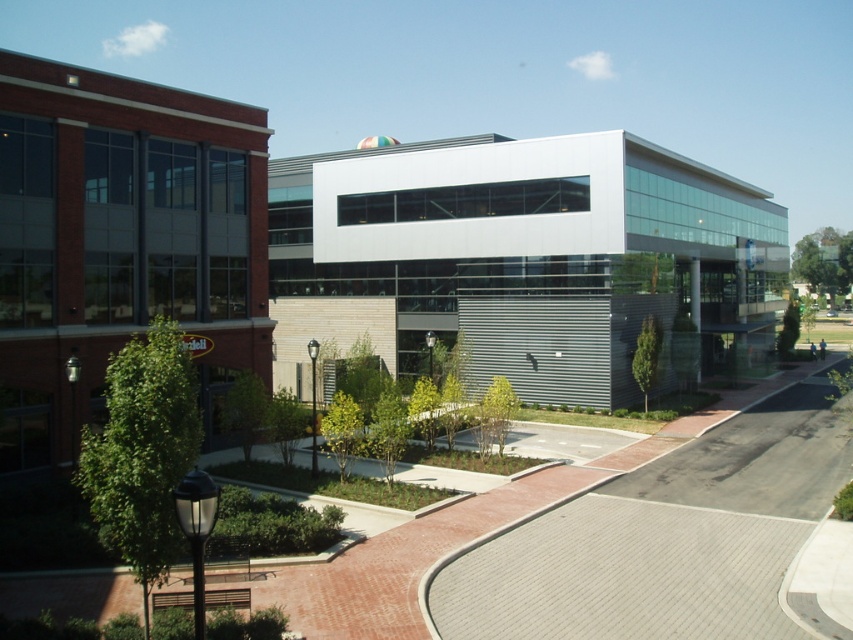
Is brick building at left positioned behind gray brick pavement at center?

Yes, brick building at left is behind gray brick pavement at center.

Looking at this image, measure the distance between point (32, 292) and camera.

Point (32, 292) is 21.37 meters away from camera.

Is point (115, 170) farther from viewer compared to point (790, 506)?

Yes, it is.

Locate an element on the screen. The height and width of the screenshot is (640, 853). brick building at left is located at coordinates (120, 243).

Is white metallic building at center wider than gray brick pavement at center?

Yes.

Between white metallic building at center and gray brick pavement at center, which one has more height?

With more height is white metallic building at center.

Is point (306, 246) positioned after point (602, 579)?

Yes.

Image resolution: width=853 pixels, height=640 pixels. Identify the location of white metallic building at center. (527, 260).

Between white metallic building at center and brick building at left, which one is positioned higher?

white metallic building at center is higher up.

Is point (409, 168) positioned behind point (45, 250)?

Yes, it is behind point (45, 250).

Where is `white metallic building at center`? Image resolution: width=853 pixels, height=640 pixels. white metallic building at center is located at coordinates (527, 260).